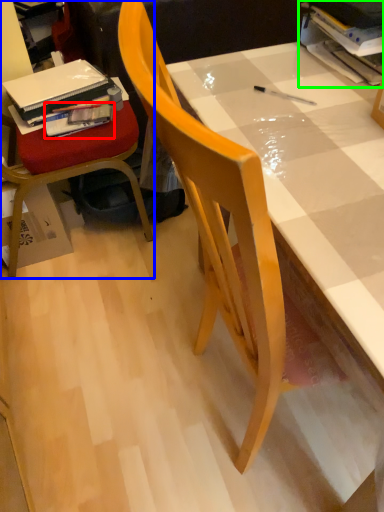
Question: Which is farther away from book (highlighted by a red box)? chair (highlighted by a blue box) or book (highlighted by a green box)?

Choices:
 (A) chair
 (B) book

Answer: (B)